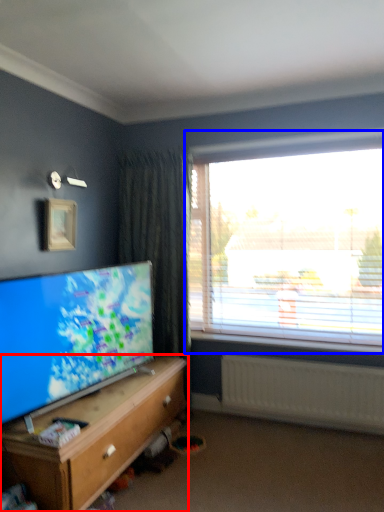
Question: Which object appears closest to the camera in this image, cabinetry (highlighted by a red box) or window (highlighted by a blue box)?

Choices:
 (A) cabinetry
 (B) window

Answer: (A)